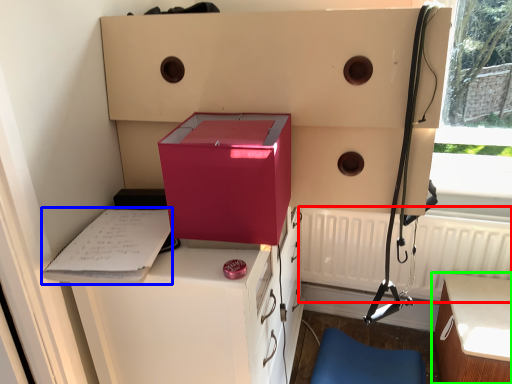
Question: Which is nearer to the radiator (highlighted by a red box)? clipboard (highlighted by a blue box) or table (highlighted by a green box).

Choices:
 (A) clipboard
 (B) table

Answer: (B)